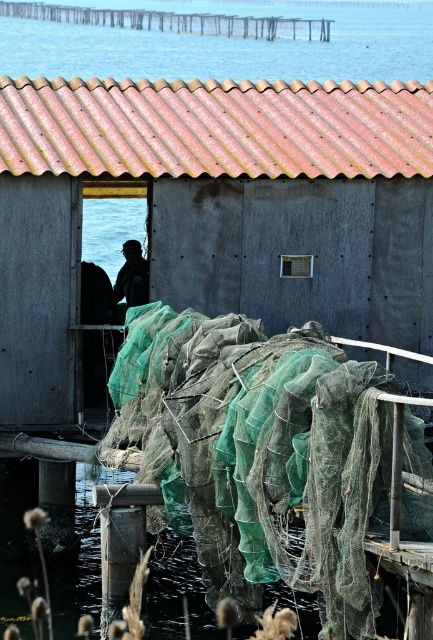
You are standing at the coordinates point 0.250, 0.500 in the image. You want to move to the rustic corrugated metal hut at center. In which direction should you move?

Since the rustic corrugated metal hut at center is located at point [213,211] and you are at point [216,160], you should move to the right to reach it.